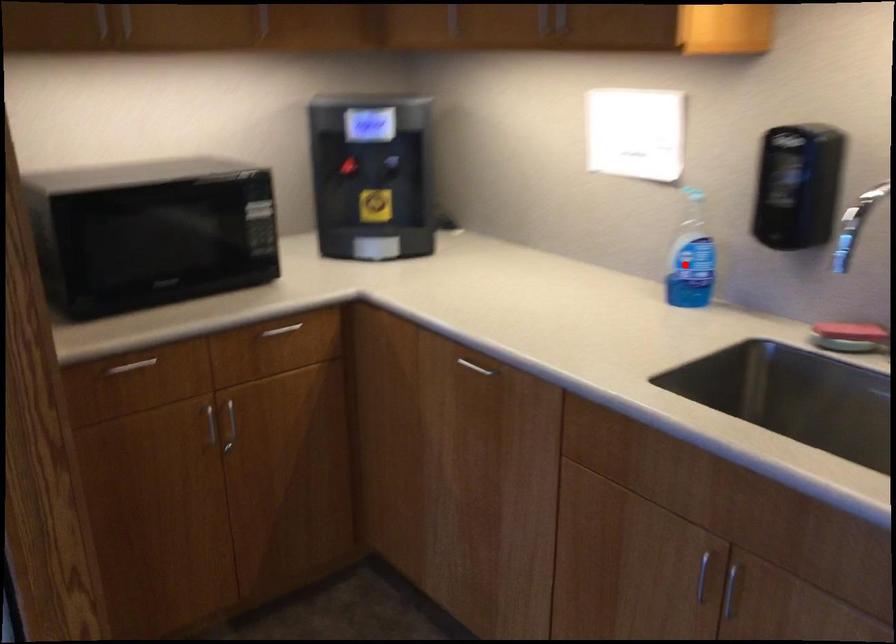
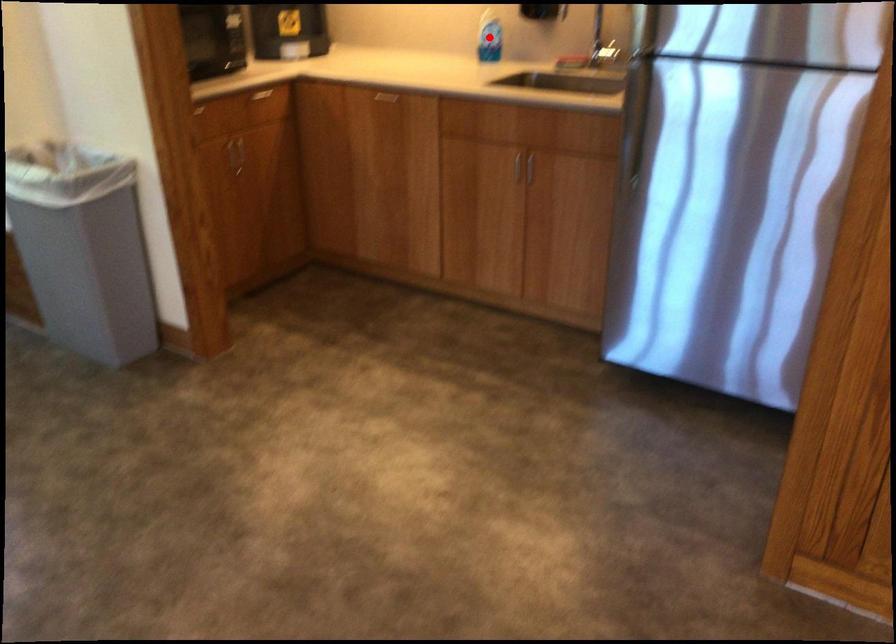
I am providing you with two images of the same scene from different viewpoints. A red point is marked on the first image and another point is marked on the second image. Does the point marked in image1 correspond to the same location as the one in image2?

Yes